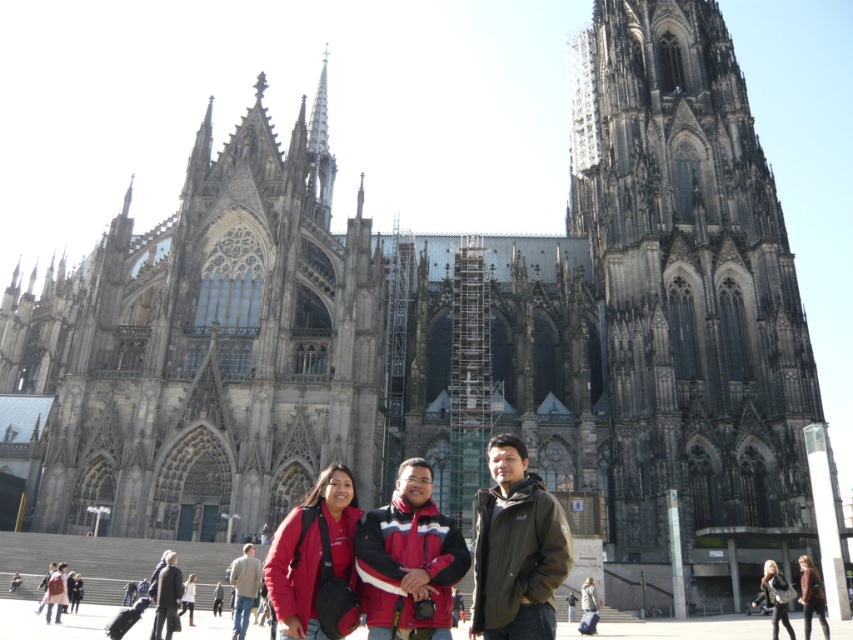
The height and width of the screenshot is (640, 853). Describe the element at coordinates (167, 596) in the screenshot. I see `matte red coat at lower center` at that location.

Between matte red coat at lower center and matte brown coat at center, which one is positioned higher?

Positioned higher is matte red coat at lower center.

Which is in front, point (171, 552) or point (821, 595)?

Point (821, 595) is more forward.

What are the coordinates of `matte red coat at lower center` in the screenshot? It's located at (167, 596).

Is point (447, 637) behind point (811, 570)?

No, it is not.

Does red and black jacket at center have a greater width compared to matte brown coat at center?

Incorrect, red and black jacket at center's width does not surpass matte brown coat at center's.

Between point (361, 600) and point (809, 580), which one is positioned behind?

Positioned behind is point (809, 580).

Identify the location of red and black jacket at center. (408, 560).

Is red and black jacket at center smaller than light brown leather jacket at center?

No, red and black jacket at center is not smaller than light brown leather jacket at center.

The width and height of the screenshot is (853, 640). Identify the location of red and black jacket at center. (408, 560).

Does point (422, 600) lie behind point (254, 577)?

No.

The width and height of the screenshot is (853, 640). In order to click on red and black jacket at center in this screenshot , I will do `click(408, 560)`.